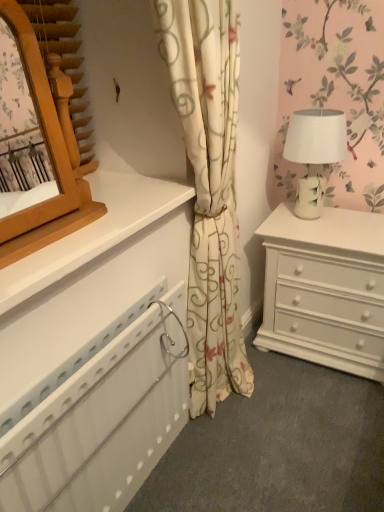
Where is `vacant space situated on the left part of white ceramic table lamp at right`? vacant space situated on the left part of white ceramic table lamp at right is located at coordinates (277, 220).